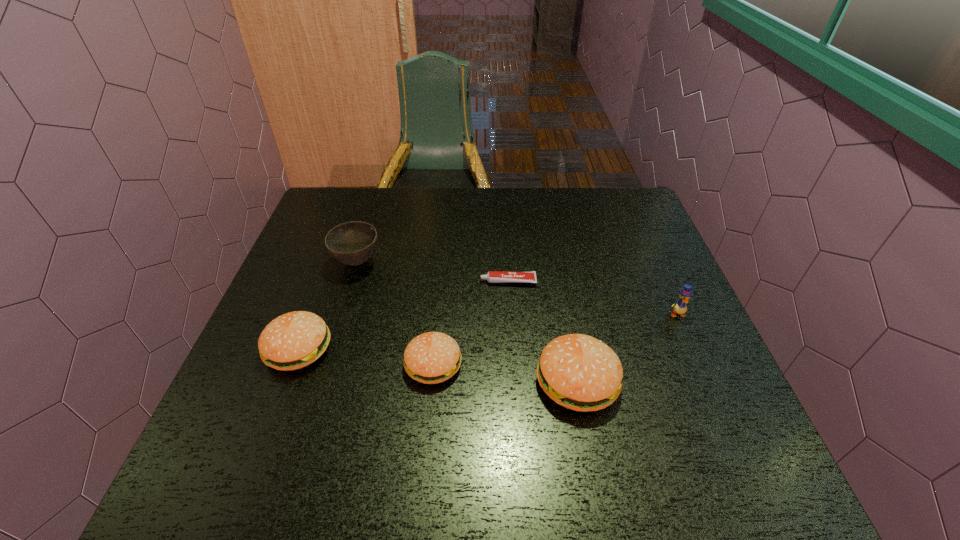
Please point a free position for a patty on the right. Please provide its 2D coordinates. Your answer should be formatted as a tuple, i.e. [(x, y)], where the tuple contains the x and y coordinates of a point satisfying the conditions above.

[(731, 399)]